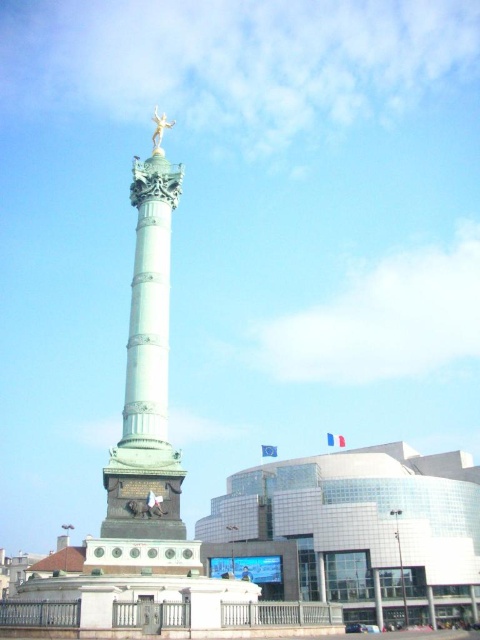
You are standing in front of the Colonne de Juillet monument and notice two points marked on the monument. The first point is at coordinates point (x=156, y=200) and the second point is at point (x=156, y=140). Which of these two points is closer to your current position?

Point (x=156, y=200) is closer to the camera than point (x=156, y=140), so the first point is closer to your current position.

You are standing at the point marked with coordinates [146,372] in the image. What significant structure are you facing?

The point at coordinates [146,372] corresponds to the bronze or golden column at center, which is the Colonne de Juillet, a historical monument in Paris.